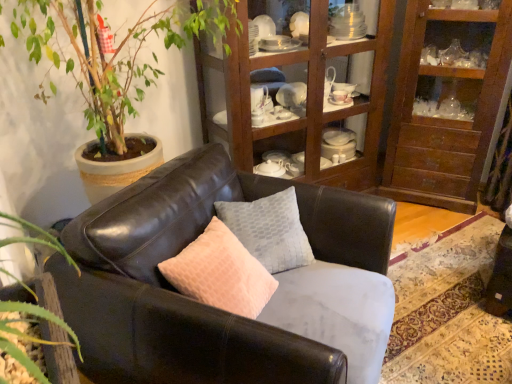
What do you see at coordinates (269, 230) in the screenshot? Image resolution: width=512 pixels, height=384 pixels. I see `textured gray pillow at center` at bounding box center [269, 230].

Describe the element at coordinates (216, 309) in the screenshot. The height and width of the screenshot is (384, 512). I see `matte leather couch at center` at that location.

Find the location of a particular element. This screenshot has height=384, width=512. wooden cabinet at upper right is located at coordinates (448, 106).

This screenshot has width=512, height=384. Identify the location of textured gray pillow at center. (269, 230).

Considering the sizes of objects wooden cabinet at upper right and matte leather couch at center in the image provided, who is shorter, wooden cabinet at upper right or matte leather couch at center?

Standing shorter between the two is matte leather couch at center.

Considering the sizes of objects wooden cabinet at upper right and matte leather couch at center in the image provided, who is wider, wooden cabinet at upper right or matte leather couch at center?

With larger width is matte leather couch at center.

From a real-world perspective, between wooden cabinet at upper right and matte leather couch at center, who is vertically lower?

matte leather couch at center is physically lower.

Image resolution: width=512 pixels, height=384 pixels. Find the location of `studio couch below the wooden cabinet at upper right (from the image's perspective)`. studio couch below the wooden cabinet at upper right (from the image's perspective) is located at coordinates (216, 309).

Find the location of `pillow lying below the wooden cabinet at upper center (from the image's perspective)`. pillow lying below the wooden cabinet at upper center (from the image's perspective) is located at coordinates (269, 230).

Considering their positions, is textured gray pillow at center located in front of or behind wooden cabinet at upper center?

Clearly, textured gray pillow at center is in front of wooden cabinet at upper center.

From the image's perspective, between textured gray pillow at center and wooden cabinet at upper center, who is located below?

From the image's view, textured gray pillow at center is below.

Is textured gray pillow at center outside of wooden cabinet at upper center?

Yes, textured gray pillow at center is located beyond the bounds of wooden cabinet at upper center.

Is green leafy plant at upper left inside matte leather couch at center?

Actually, green leafy plant at upper left is outside matte leather couch at center.

Can you confirm if matte leather couch at center is smaller than green leafy plant at upper left?

Correct, matte leather couch at center occupies less space than green leafy plant at upper left.

Where is `studio couch below the green leafy plant at upper left (from the image's perspective)`? studio couch below the green leafy plant at upper left (from the image's perspective) is located at coordinates (216, 309).

Considering the relative positions of matte leather couch at center and green leafy plant at upper left in the image provided, is matte leather couch at center to the left or to the right of green leafy plant at upper left?

Based on their positions, matte leather couch at center is located to the right of green leafy plant at upper left.

Is point (183, 15) positioned behind point (264, 227)?

Yes, point (183, 15) is behind point (264, 227).

From the image's perspective, is green leafy plant at upper left beneath textured gray pillow at center?

No, from the image's perspective, green leafy plant at upper left is not below textured gray pillow at center.

Is green leafy plant at upper left with textured gray pillow at center?

green leafy plant at upper left and textured gray pillow at center are clearly separated.

Image resolution: width=512 pixels, height=384 pixels. Find the location of `pillow that appears behind the green leafy plant at upper left`. pillow that appears behind the green leafy plant at upper left is located at coordinates (269, 230).

How many degrees apart are the facing directions of wooden cabinet at upper right and textured gray pillow at center?

wooden cabinet at upper right and textured gray pillow at center are facing 41.8 degrees away from each other.

Considering the sizes of objects wooden cabinet at upper right and textured gray pillow at center in the image provided, who is shorter, wooden cabinet at upper right or textured gray pillow at center?

With less height is textured gray pillow at center.

From a real-world perspective, is wooden cabinet at upper right positioned above or below textured gray pillow at center?

Clearly, from a real-world perspective, wooden cabinet at upper right is above textured gray pillow at center.

Are wooden cabinet at upper right and green leafy plant at upper left beside each other?

No, wooden cabinet at upper right is not with green leafy plant at upper left.

Is wooden cabinet at upper right shorter than green leafy plant at upper left?

No.

From a real-world perspective, is wooden cabinet at upper center over textured gray pillow at center?

Yes, from a real-world perspective, wooden cabinet at upper center is over textured gray pillow at center

Is wooden cabinet at upper center to the left of textured gray pillow at center from the viewer's perspective?

Incorrect, wooden cabinet at upper center is not on the left side of textured gray pillow at center.

Who is more distant, wooden cabinet at upper center or textured gray pillow at center?

wooden cabinet at upper center is further from the camera.

Which of these two, wooden cabinet at upper center or textured gray pillow at center, is thinner?

Thinner between the two is textured gray pillow at center.

I want to click on shelf behind the matte leather couch at center, so click(x=448, y=106).

What are the coordinates of `pillow below the wooden cabinet at upper center (from a real-world perspective)` in the screenshot? It's located at click(x=269, y=230).

When comparing their distances from matte leather couch at center, does wooden cabinet at upper right or green leafy plant at upper left seem further?

The object further to matte leather couch at center is wooden cabinet at upper right.

Considering their positions, is wooden cabinet at upper center positioned closer to matte leather couch at center than wooden cabinet at upper right?

The object closer to matte leather couch at center is wooden cabinet at upper center.

Based on the photo, which object lies further to the anchor point matte leather couch at center, wooden cabinet at upper right or wooden cabinet at upper center?

wooden cabinet at upper right lies further to matte leather couch at center than the other object.

Considering their positions, is matte leather couch at center positioned closer to wooden cabinet at upper right than textured gray pillow at center?

Based on the image, textured gray pillow at center appears to be nearer to wooden cabinet at upper right.

Based on the photo, looking at the image, which one is located closer to matte leather couch at center, green leafy plant at upper left or wooden cabinet at upper right?

green leafy plant at upper left.

Which object lies further to the anchor point textured gray pillow at center, wooden cabinet at upper right or green leafy plant at upper left?

Based on the image, wooden cabinet at upper right appears to be further to textured gray pillow at center.

In the scene shown: Based on their spatial positions, is textured gray pillow at center or matte leather couch at center further from wooden cabinet at upper center?

The object further to wooden cabinet at upper center is matte leather couch at center.

Which object lies further to the anchor point textured gray pillow at center, green leafy plant at upper left or wooden cabinet at upper right?

Based on the image, wooden cabinet at upper right appears to be further to textured gray pillow at center.

You are a GUI agent. You are given a task and a screenshot of the screen. Output one action in this format:
    pyautogui.click(x=<x>, y=<y>)
    Task: Click on the pillow located between matte leather couch at center and wooden cabinet at upper center in the depth direction
    
    Given the screenshot: What is the action you would take?
    pyautogui.click(x=269, y=230)

Locate an element on the screen. pillow between matte leather couch at center and wooden cabinet at upper right in the horizontal direction is located at coordinates (269, 230).

I want to click on pillow between green leafy plant at upper left and matte leather couch at center vertically, so click(269, 230).

At what (x,y) coordinates should I click in order to perform the action: click on cabinetry situated between textured gray pillow at center and wooden cabinet at upper right from left to right. Please return your answer as a coordinate pair (x, y). The image size is (512, 384). Looking at the image, I should click on (381, 102).